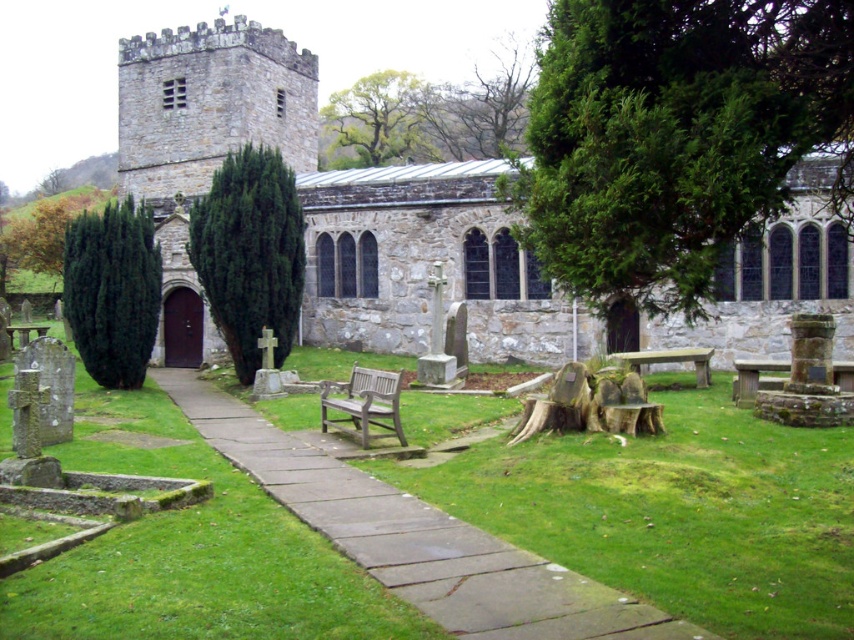
You are standing in the churchyard and want to sit on the nearest bench. Which bench should you approach? The wooden bench at center or the wooden park bench at center right?

You should approach the wooden bench at center because it is closer to you than the wooden park bench at center right.

You are standing at the entrance of the church and want to take a photo of the point marked at coordinates point (320, 387). Your camera has a maximum focus range of 30 meters. Will you be able to focus on the point from your current position?

The distance of point (320, 387) from camera is 32.67 meters, which exceeds the camera maximum focus range of 30 meters. Therefore, you won not be able to focus on the point from your current position.